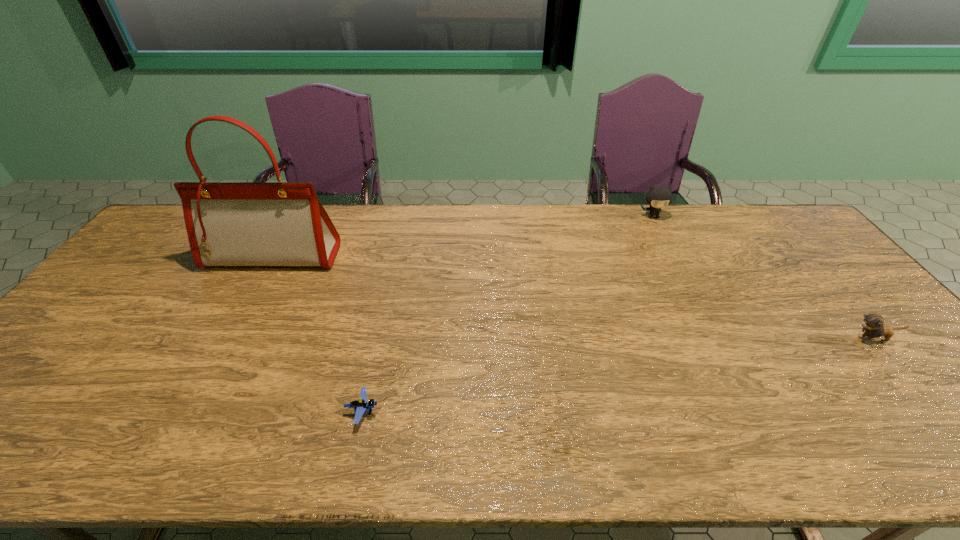
I want to click on free region at the left edge, so click(79, 388).

This screenshot has height=540, width=960. In the image, there is a desktop. Find the location of `free space at the right edge`. free space at the right edge is located at coordinates (859, 359).

I want to click on vacant point located between the shortest object and the leftmost object, so click(x=318, y=334).

At what (x,y) coordinates should I click in order to perform the action: click on vacant region between the rightmost object and the tallest object. Please return your answer as a coordinate pair (x, y). The image size is (960, 540). Looking at the image, I should click on (573, 298).

You are a GUI agent. You are given a task and a screenshot of the screen. Output one action in this format:
    pyautogui.click(x=<x>, y=<y>)
    Task: Click on the vacant space in between the second farthest object and the third farthest object
    This screenshot has height=540, width=960.
    Given the screenshot: What is the action you would take?
    pyautogui.click(x=573, y=298)

At what (x,y) coordinates should I click in order to perform the action: click on vacant region between the third tallest object and the third object from right to left. Please return your answer as a coordinate pair (x, y). Image resolution: width=960 pixels, height=540 pixels. Looking at the image, I should click on (618, 375).

Where is `free spot between the nearest object and the leftmost object`? free spot between the nearest object and the leftmost object is located at coordinates (318, 334).

The image size is (960, 540). I want to click on free spot between the handbag and the Lego, so click(318, 334).

Where is `vacant region between the shortest object and the handbag`? Image resolution: width=960 pixels, height=540 pixels. vacant region between the shortest object and the handbag is located at coordinates (318, 334).

The height and width of the screenshot is (540, 960). What are the coordinates of `blank region between the tallest object and the shorter kitten` in the screenshot? It's located at (573, 298).